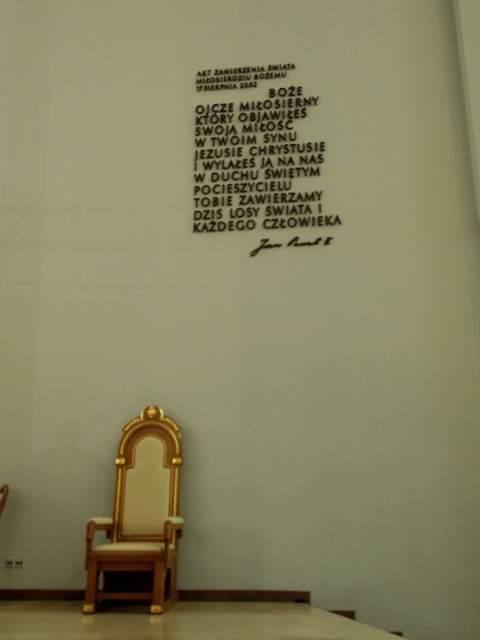
Question: Which of the following is the closest to the observer?

Choices:
 (A) (0, 500)
 (B) (103, 560)

Answer: (B)

Question: Estimate the real-world distances between objects in this image. Which object is closer to the gold wood throne at center?

Choices:
 (A) black paper at upper center
 (B) wooden polished chair at lower left

Answer: (B)

Question: Is black paper at upper center to the right of wooden polished chair at lower left from the viewer's perspective?

Choices:
 (A) no
 (B) yes

Answer: (B)

Question: Is gold wood throne at center bigger than wooden polished chair at lower left?

Choices:
 (A) no
 (B) yes

Answer: (B)

Question: Among these objects, which one is nearest to the camera?

Choices:
 (A) black paper at upper center
 (B) gold wood throne at center
 (C) wooden polished chair at lower left

Answer: (B)

Question: Considering the relative positions of black paper at upper center and wooden polished chair at lower left in the image provided, where is black paper at upper center located with respect to wooden polished chair at lower left?

Choices:
 (A) right
 (B) left

Answer: (A)